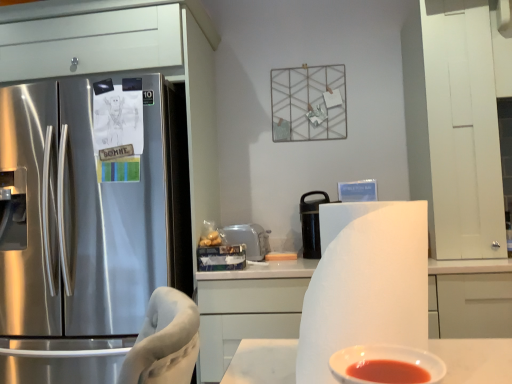
Question: From a real-world perspective, is white matte cabinet at center positioned above or below stainless steel refrigerator at left?

Choices:
 (A) below
 (B) above

Answer: (A)

Question: From the image's perspective, is white matte cabinet at center above or below stainless steel refrigerator at left?

Choices:
 (A) above
 (B) below

Answer: (B)

Question: Estimate the real-world distances between objects in this image. Which object is farther from the white matte paper towel at center?

Choices:
 (A) white plastic toaster at center, which ranks as the first appliance in left-to-right order
 (B) white matte cabinet at center
 (C) stainless steel refrigerator at left
 (D) black matte thermos at center, which is counted as the 1th appliance, starting from the right
 (E) white glossy bowl at lower center

Answer: (A)

Question: Considering the real-world distances, which object is farthest from the white matte cabinet at center?

Choices:
 (A) black matte thermos at center, which is counted as the 2th appliance, starting from the left
 (B) white matte paper towel at center
 (C) white glossy bowl at lower center
 (D) stainless steel refrigerator at left
 (E) white plastic toaster at center, which ranks as the second appliance in right-to-left order

Answer: (C)